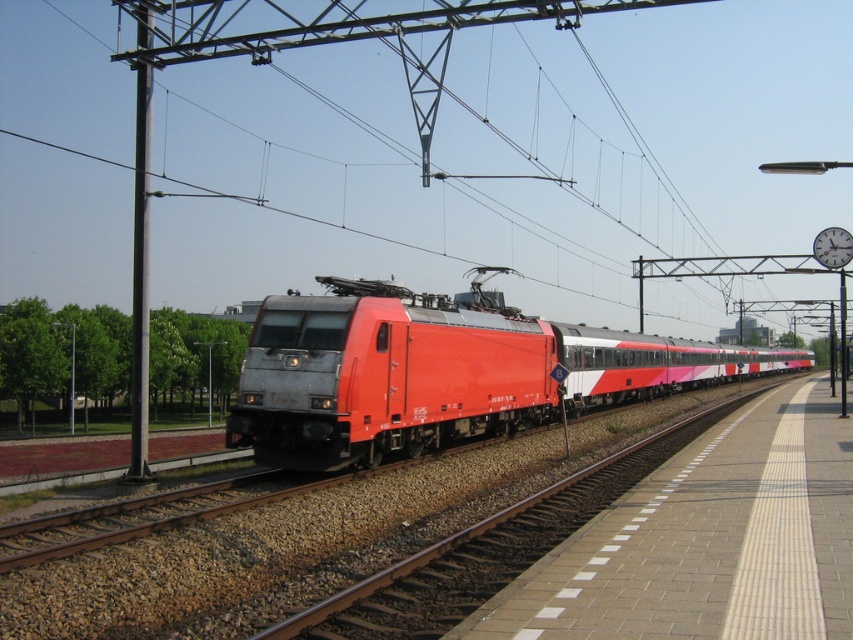
Question: Which object appears closest to the camera in this image?

Choices:
 (A) metallic red train at center
 (B) brick platform at center

Answer: (B)

Question: Can you confirm if metallic red train at center is positioned to the left of brick platform at center?

Choices:
 (A) yes
 (B) no

Answer: (B)

Question: Which point is closer to the camera?

Choices:
 (A) (688, 452)
 (B) (550, 412)

Answer: (A)

Question: Can you confirm if metallic red train at center is positioned to the right of brick platform at center?

Choices:
 (A) no
 (B) yes

Answer: (B)

Question: Is metallic red train at center to the right of brick platform at center from the viewer's perspective?

Choices:
 (A) yes
 (B) no

Answer: (A)

Question: Which point is closer to the camera taking this photo?

Choices:
 (A) (485, 353)
 (B) (759, 524)

Answer: (B)